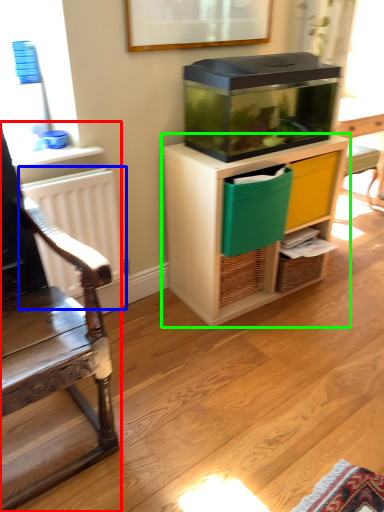
Question: Which object is positioned closest to chair (highlighted by a red box)? Select from radiator (highlighted by a blue box) and cabinetry (highlighted by a green box).

Choices:
 (A) radiator
 (B) cabinetry

Answer: (A)